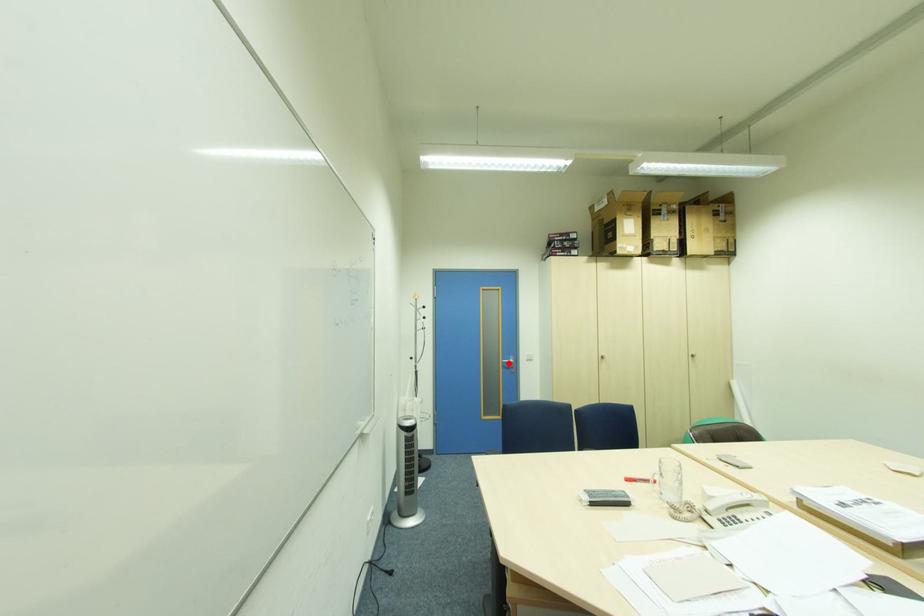
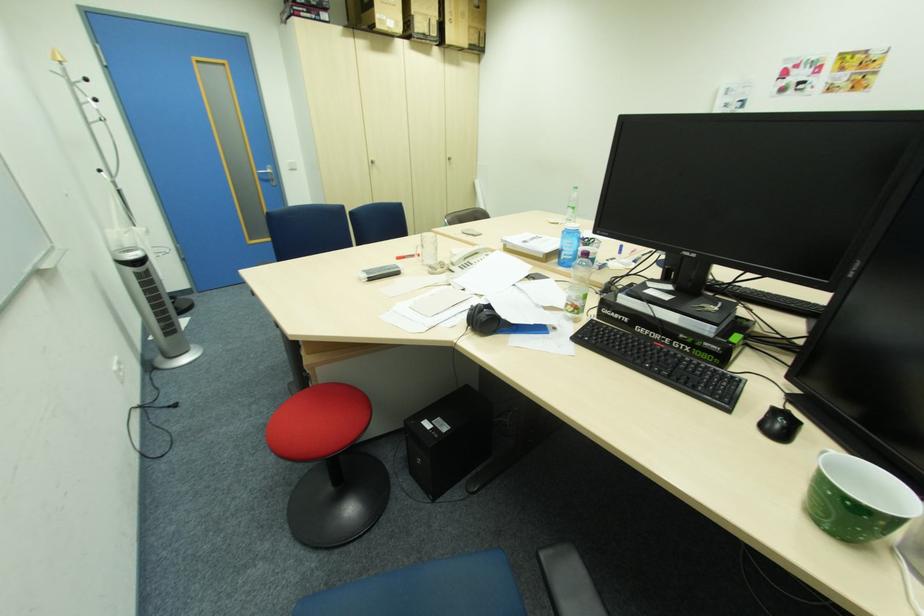
Question: I am providing you with two images of the same scene from different viewpoints. A red point is shown in image1. For the corresponding object point in image2, is it positioned nearer or farther from the camera?

Choices:
 (A) Nearer
 (B) Farther

Answer: (A)